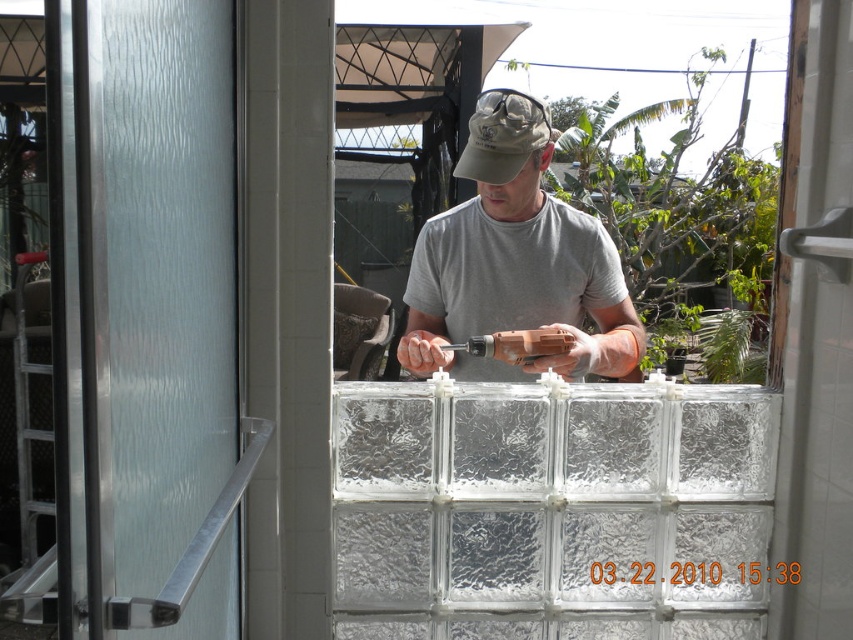
Does gray matte shirt at center have a greater height compared to orange plastic drill at center?

Correct, gray matte shirt at center is much taller as orange plastic drill at center.

Between gray matte shirt at center and orange plastic drill at center, which one has less height?

Standing shorter between the two is orange plastic drill at center.

Locate an element on the screen. The height and width of the screenshot is (640, 853). gray matte shirt at center is located at coordinates (515, 260).

This screenshot has width=853, height=640. I want to click on gray matte shirt at center, so pyautogui.click(x=515, y=260).

Which is above, frosted glass screen door at left or gray matte shirt at center?

Positioned higher is gray matte shirt at center.

Based on the photo, can you confirm if frosted glass screen door at left is wider than gray matte shirt at center?

In fact, frosted glass screen door at left might be narrower than gray matte shirt at center.

Who is more forward, (236, 380) or (447, 320)?

Positioned in front is point (236, 380).

Where is `frosted glass screen door at left`? The width and height of the screenshot is (853, 640). frosted glass screen door at left is located at coordinates (160, 316).

This screenshot has height=640, width=853. What do you see at coordinates (160, 316) in the screenshot?
I see `frosted glass screen door at left` at bounding box center [160, 316].

Measure the distance between point (83, 122) and camera.

They are 36.95 inches apart.

Where is `frosted glass screen door at left`? frosted glass screen door at left is located at coordinates (160, 316).